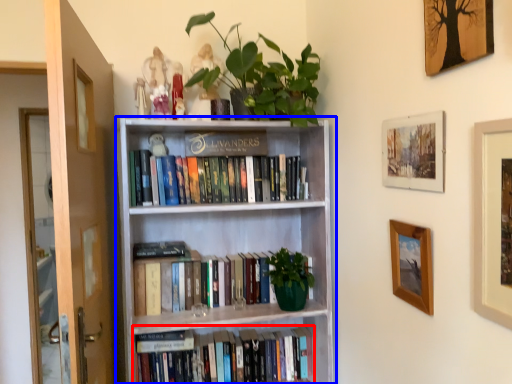
Question: Which point is further to the camera, book (highlighted by a red box) or bookcase (highlighted by a blue box)?

Choices:
 (A) book
 (B) bookcase

Answer: (A)